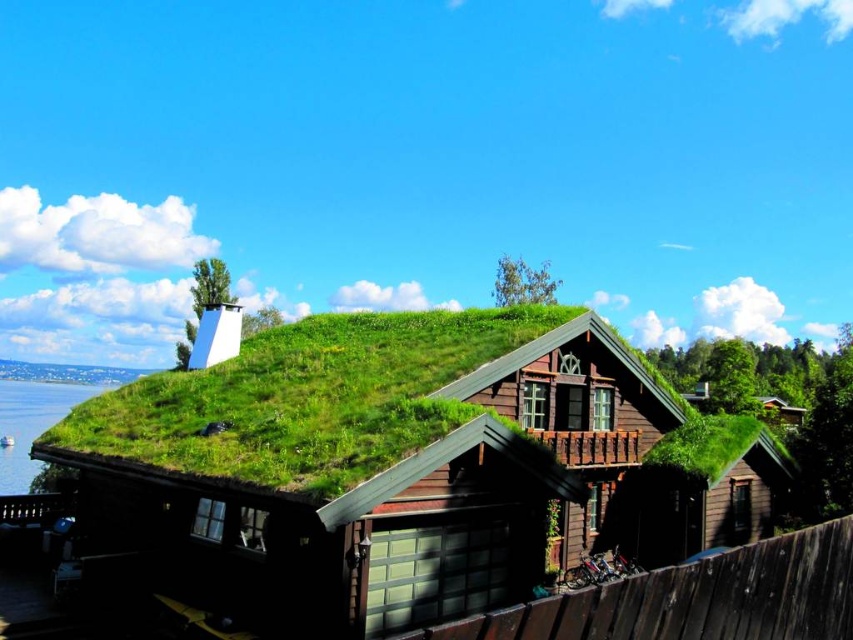
Question: Does brown wooden cabin at center have a lesser width compared to blue water at lower left?

Choices:
 (A) no
 (B) yes

Answer: (B)

Question: Which point is farther to the camera?

Choices:
 (A) (587, 349)
 (B) (0, 401)

Answer: (B)

Question: Which point is farther to the camera?

Choices:
 (A) brown wooden cabin at center
 (B) blue water at lower left

Answer: (B)

Question: Can you confirm if brown wooden cabin at center is positioned to the left of blue water at lower left?

Choices:
 (A) no
 (B) yes

Answer: (A)

Question: Does brown wooden cabin at center have a lesser width compared to blue water at lower left?

Choices:
 (A) yes
 (B) no

Answer: (A)